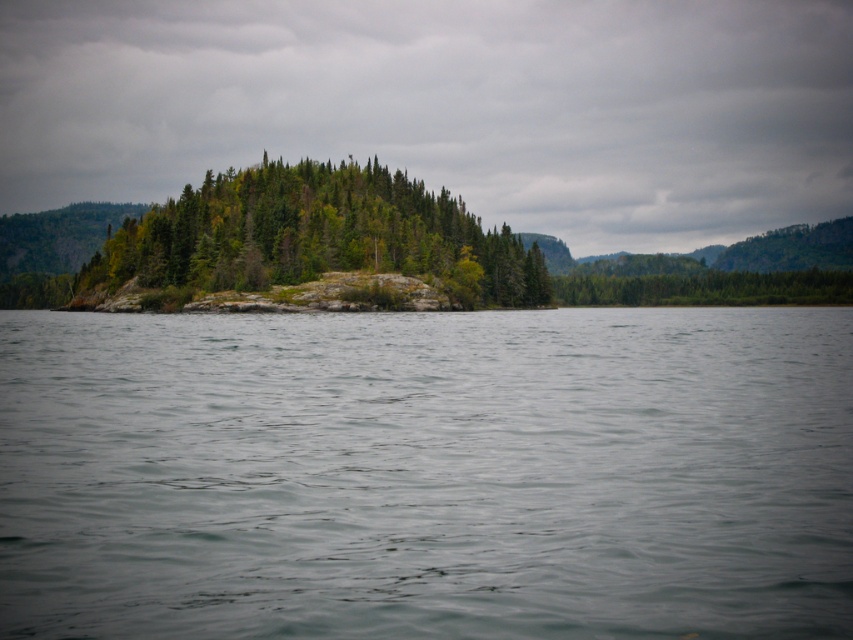
Question: Which object is closer to the camera taking this photo?

Choices:
 (A) green matte forest at center
 (B) gray water at center

Answer: (B)

Question: Which of the following is the closest to the observer?

Choices:
 (A) (264, 240)
 (B) (141, 552)

Answer: (B)

Question: Is gray water at center closer to camera compared to green matte forest at center?

Choices:
 (A) yes
 (B) no

Answer: (A)

Question: Does gray water at center come in front of green matte forest at center?

Choices:
 (A) no
 (B) yes

Answer: (B)

Question: Is gray water at center thinner than green matte forest at center?

Choices:
 (A) no
 (B) yes

Answer: (B)